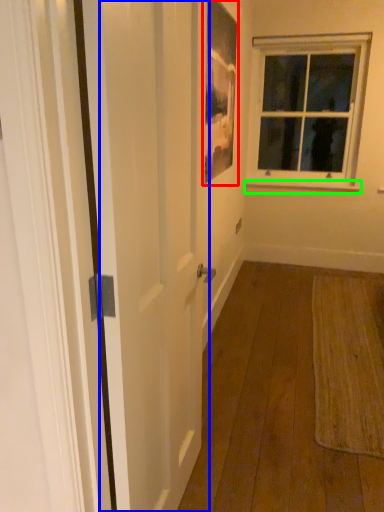
Question: Which object is the farthest from picture frame (highlighted by a red box)? Choose among these: screen door (highlighted by a blue box) or window sill (highlighted by a green box).

Choices:
 (A) screen door
 (B) window sill

Answer: (B)